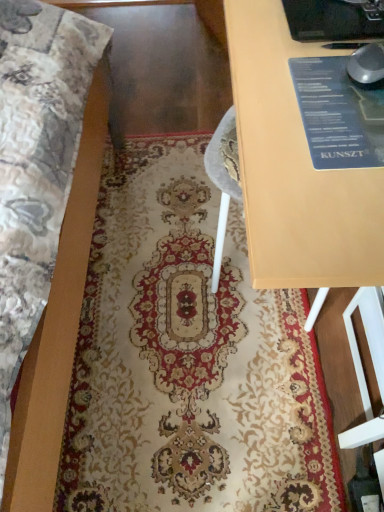
Locate an element on the screen. The height and width of the screenshot is (512, 384). free point below carpet with intricate patterns at center (from a real-world perspective) is located at coordinates (176, 307).